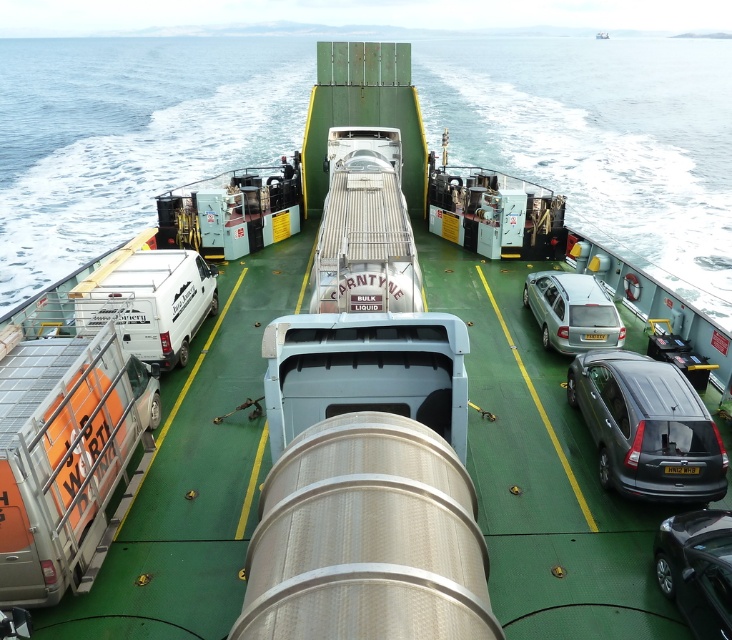
Question: Which is nearer to the yellow matte license plate at center?

Choices:
 (A) metallic gray hatchback at center right
 (B) satin silver car at center-right
 (C) shiny black sedan at lower right
 (D) clear blue water at center

Answer: (A)

Question: Does clear blue water at center have a lesser width compared to yellow matte license plate at center?

Choices:
 (A) yes
 (B) no

Answer: (B)

Question: Can you confirm if yellow matte license plate at center is wider than yellow plastic license plate at center?

Choices:
 (A) no
 (B) yes

Answer: (B)

Question: Estimate the real-world distances between objects in this image. Which object is closer to the yellow plastic license plate at center?

Choices:
 (A) shiny black sedan at lower right
 (B) clear blue water at center
 (C) satin silver car at center-right
 (D) metallic gray hatchback at center right

Answer: (C)

Question: Which object appears closest to the camera in this image?

Choices:
 (A) shiny black sedan at lower right
 (B) yellow matte license plate at center
 (C) metallic gray hatchback at center right
 (D) clear blue water at center

Answer: (A)

Question: Where is clear blue water at center located in relation to metallic gray hatchback at center right in the image?

Choices:
 (A) right
 (B) left

Answer: (B)